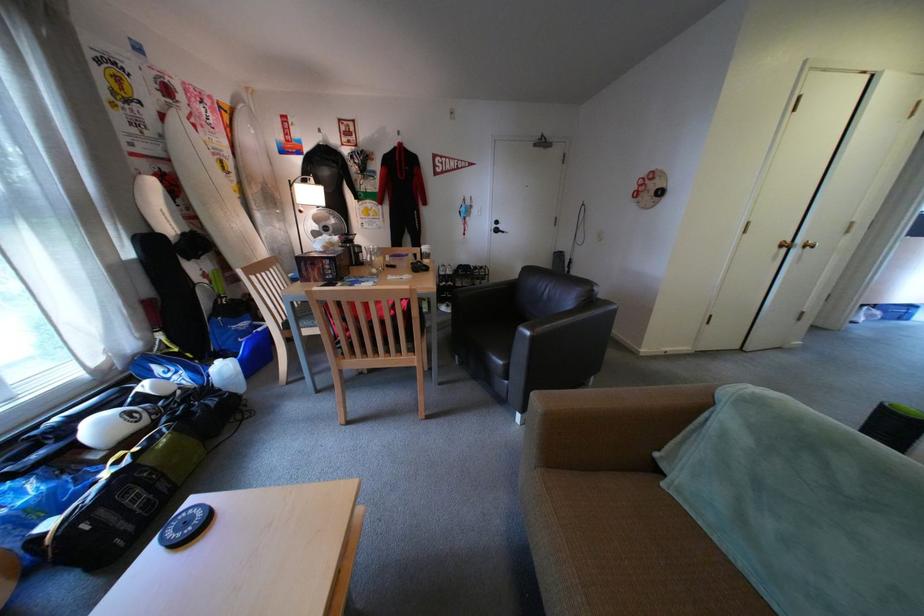
This screenshot has height=616, width=924. Find the location of `sofa sitting surface`. sofa sitting surface is located at coordinates (641, 549).